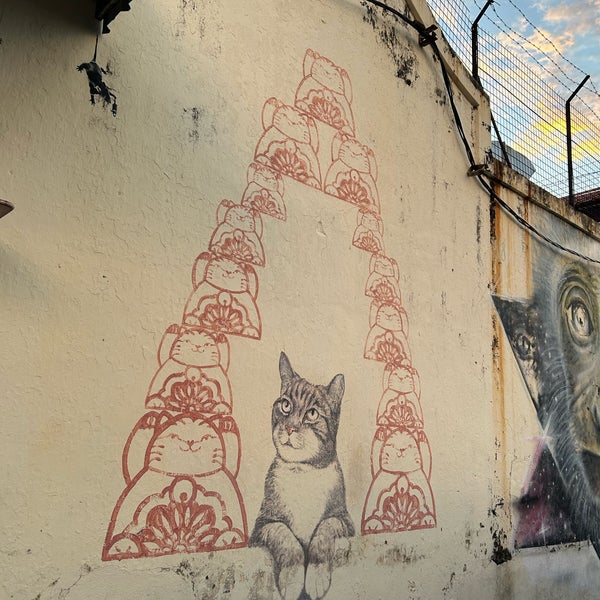
Image resolution: width=600 pixels, height=600 pixels. What are the coordinates of `black spot on wall` in the screenshot? It's located at (501, 554).